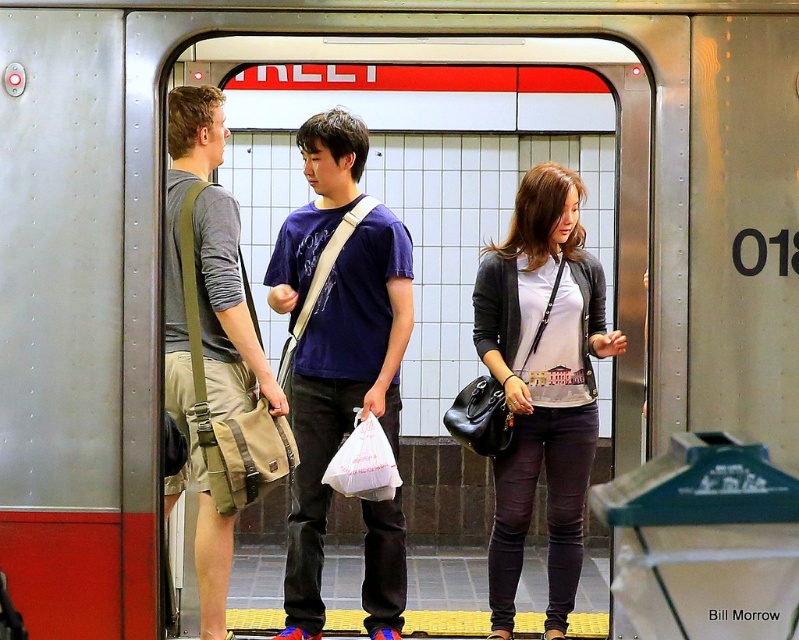
Question: Which point is closer to the camera taking this photo?

Choices:
 (A) (229, 576)
 (B) (400, 298)

Answer: (A)

Question: Among these points, which one is nearest to the camera?

Choices:
 (A) (303, 541)
 (B) (517, 310)
 (C) (175, 397)

Answer: (C)

Question: Which point is farther to the camera?

Choices:
 (A) (334, 275)
 (B) (551, 600)

Answer: (B)

Question: Can you confirm if matte blue t-shirt at center is positioned to the right of matte black purse at center?

Choices:
 (A) yes
 (B) no

Answer: (B)

Question: Is matte black purse at center positioned before khaki shorts at left?

Choices:
 (A) yes
 (B) no

Answer: (B)

Question: Does matte blue t-shirt at center lie in front of matte black purse at center?

Choices:
 (A) yes
 (B) no

Answer: (B)